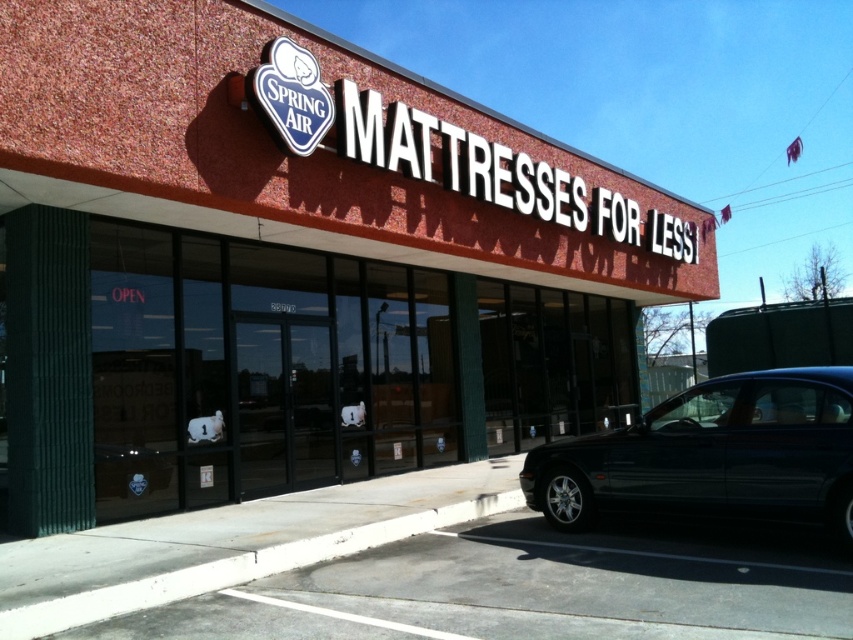
Question: Does red brick building at center come in front of shiny dark blue sedan at lower right?

Choices:
 (A) no
 (B) yes

Answer: (B)

Question: Which point is farther to the camera?

Choices:
 (A) (526, 256)
 (B) (664, 429)

Answer: (A)

Question: Can you confirm if red brick building at center is positioned above shiny dark blue sedan at lower right?

Choices:
 (A) no
 (B) yes

Answer: (B)

Question: Can you confirm if red brick building at center is thinner than shiny dark blue sedan at lower right?

Choices:
 (A) no
 (B) yes

Answer: (A)

Question: Which point appears closest to the camera in this image?

Choices:
 (A) (86, 353)
 (B) (668, 472)

Answer: (B)